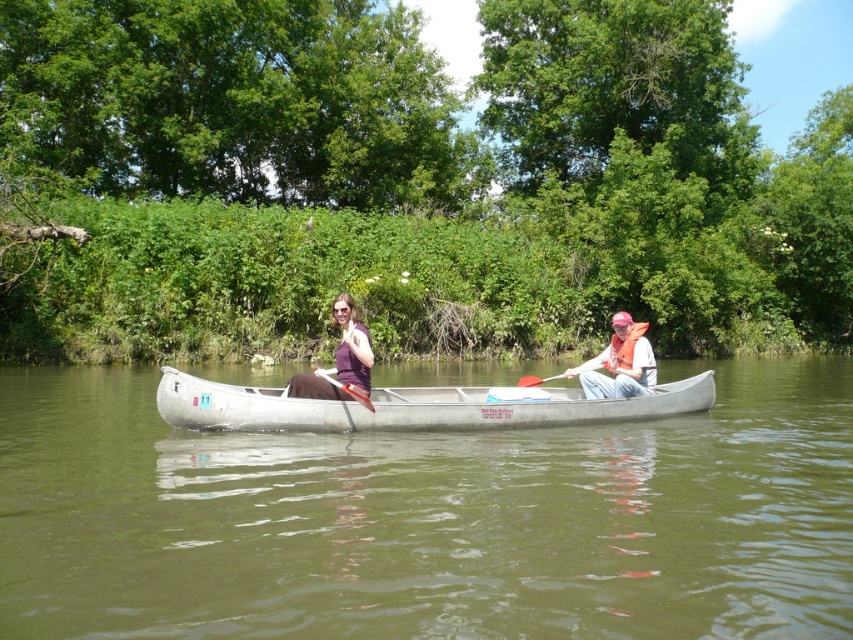
You are a photographer planning to take a picture of the purple fabric at center and the white plastic paddle at center in the canoe scene. If you want to emphasize the size difference between them, which object should you focus on to highlight its larger size?

The purple fabric at center has a larger size compared to the white plastic paddle at center, so focusing on the purple fabric at center would emphasize its larger size.